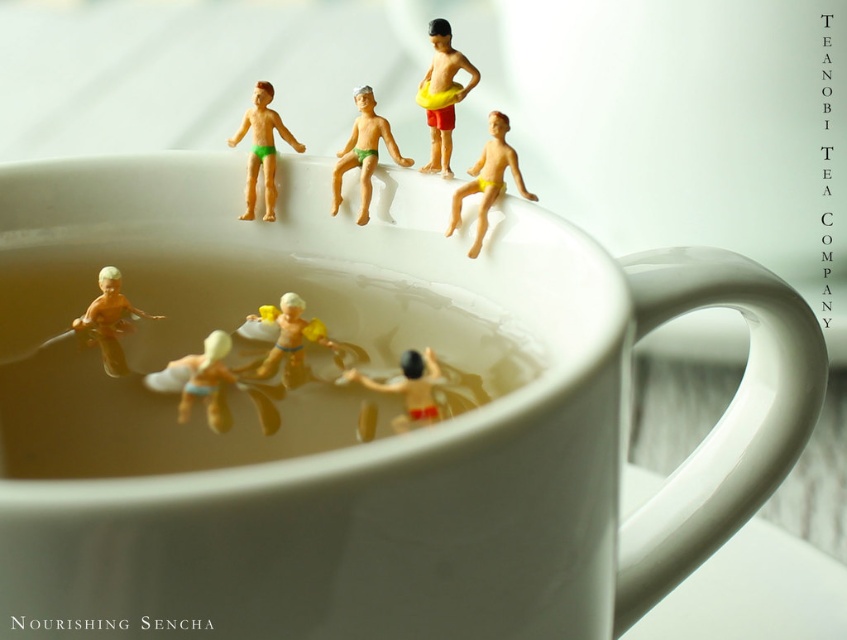
Is yellow matte toy at upper right bigger than matte yellow plastic boy at lower left?

No.

Who is taller, yellow matte toy at upper right or matte yellow plastic boy at lower left?

With more height is yellow matte toy at upper right.

What do you see at coordinates (488, 179) in the screenshot? Image resolution: width=847 pixels, height=640 pixels. I see `yellow matte toy at upper right` at bounding box center [488, 179].

The image size is (847, 640). Find the location of `yellow matte toy at upper right`. yellow matte toy at upper right is located at coordinates (488, 179).

Between matte yellow toy at upper center and yellow matte toy at center, which one has more height?

yellow matte toy at center is taller.

Does matte yellow toy at upper center have a smaller size compared to yellow matte toy at center?

Indeed, matte yellow toy at upper center has a smaller size compared to yellow matte toy at center.

Consider the image. Who is more distant from viewer, [430,376] or [297,372]?

Point [297,372]

The image size is (847, 640). What are the coordinates of `matte yellow toy at upper center` in the screenshot? It's located at (407, 387).

Can you confirm if yellow rubber ring at upper center is smaller than yellow matte toy at center?

No, yellow rubber ring at upper center is not smaller than yellow matte toy at center.

Locate an element on the screen. The image size is (847, 640). yellow rubber ring at upper center is located at coordinates (441, 93).

What do you see at coordinates (441, 93) in the screenshot?
I see `yellow rubber ring at upper center` at bounding box center [441, 93].

What are the coordinates of `yellow rubber ring at upper center` in the screenshot? It's located at (441, 93).